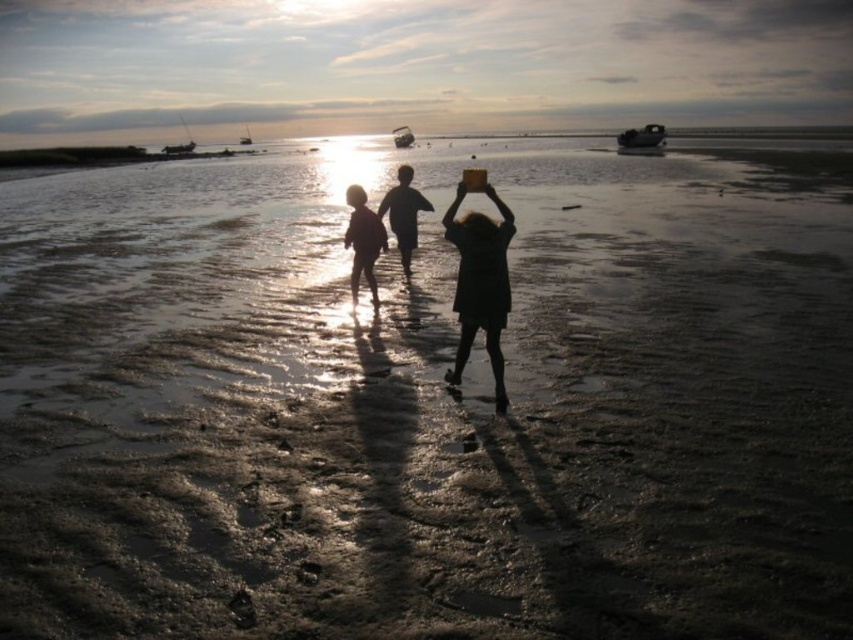
Is silhouette figure at center to the left of metallic silver boat at center from the viewer's perspective?

No, silhouette figure at center is not to the left of metallic silver boat at center.

Between silhouette figure at center and metallic silver boat at center, which one appears on the right side from the viewer's perspective?

silhouette figure at center

The height and width of the screenshot is (640, 853). What do you see at coordinates (403, 212) in the screenshot?
I see `silhouette figure at center` at bounding box center [403, 212].

You are a GUI agent. You are given a task and a screenshot of the screen. Output one action in this format:
    pyautogui.click(x=<x>, y=<y>)
    Task: Click on the silhouette figure at center
    
    Given the screenshot: What is the action you would take?
    pyautogui.click(x=403, y=212)

Is metallic gray boat at upper right thinner than metallic silver boat at center?

No, metallic gray boat at upper right is not thinner than metallic silver boat at center.

Which is more to the left, metallic gray boat at upper right or metallic silver boat at center?

Positioned to the left is metallic silver boat at center.

Which is in front, point (639, 128) or point (407, 128)?

Point (407, 128) is in front.

Identify the location of metallic gray boat at upper right. (642, 140).

In the scene shown: Who is more distant from viewer, (508, 216) or (643, 141)?

The point (643, 141) is behind.

Locate an element on the screen. This screenshot has width=853, height=640. black matte dress at center is located at coordinates (480, 284).

At what (x,y) coordinates should I click in order to perform the action: click on black matte dress at center. Please return your answer as a coordinate pair (x, y). Looking at the image, I should click on (480, 284).